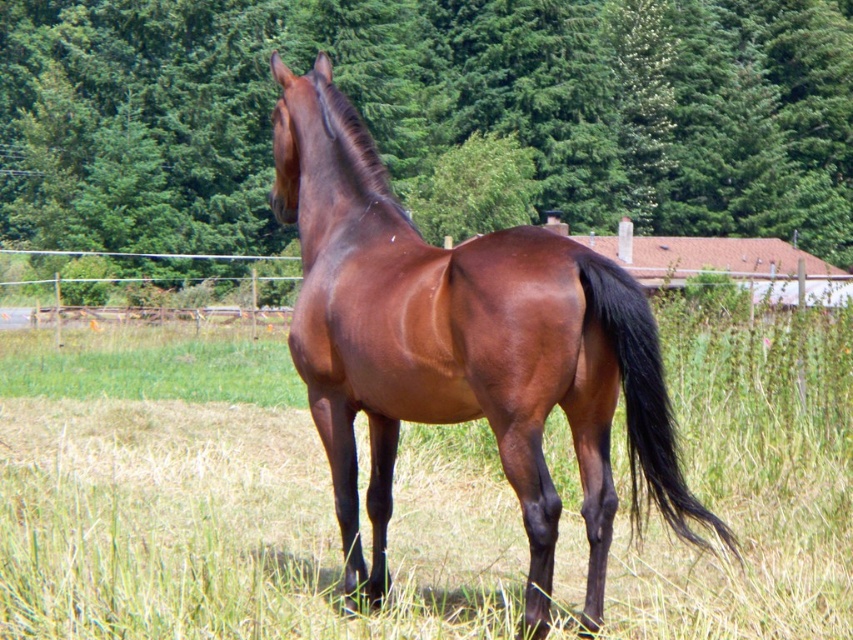
You are a photographer trying to capture the shiny brown horse at center and the green leafy tree at upper center in the same frame. Based on their positions, which object is positioned higher in the image?

The green leafy tree at upper center is positioned higher in the image than the shiny brown horse at center.